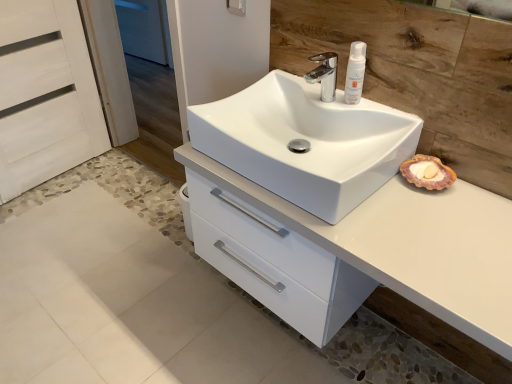
Question: Is the position of white glossy sink at center more distant than that of white matte lotion at upper right?

Choices:
 (A) no
 (B) yes

Answer: (A)

Question: From the image's perspective, would you say white glossy sink at center is shown under white matte lotion at upper right?

Choices:
 (A) no
 (B) yes

Answer: (B)

Question: Is white glossy sink at center positioned before white matte lotion at upper right?

Choices:
 (A) yes
 (B) no

Answer: (A)

Question: Does white glossy sink at center appear on the right side of white matte lotion at upper right?

Choices:
 (A) yes
 (B) no

Answer: (B)

Question: Can you confirm if white glossy sink at center is shorter than white matte lotion at upper right?

Choices:
 (A) no
 (B) yes

Answer: (B)

Question: From the image's perspective, is white glossy sink at center above white matte lotion at upper right?

Choices:
 (A) yes
 (B) no

Answer: (B)

Question: Does chrome metallic faucet at upper center appear on the right side of white matte lotion at upper right?

Choices:
 (A) yes
 (B) no

Answer: (B)

Question: Can we say chrome metallic faucet at upper center lies outside white matte lotion at upper right?

Choices:
 (A) no
 (B) yes

Answer: (B)

Question: Would you consider chrome metallic faucet at upper center to be distant from white matte lotion at upper right?

Choices:
 (A) yes
 (B) no

Answer: (B)

Question: Is white matte lotion at upper right surrounded by chrome metallic faucet at upper center?

Choices:
 (A) yes
 (B) no

Answer: (B)

Question: Is chrome metallic faucet at upper center touching white matte lotion at upper right?

Choices:
 (A) no
 (B) yes

Answer: (A)

Question: Is chrome metallic faucet at upper center shorter than white matte lotion at upper right?

Choices:
 (A) no
 (B) yes

Answer: (B)

Question: Is white wood screen door at left, which appears as the 1th screen door when viewed from the right, not within chrome metallic faucet at upper center?

Choices:
 (A) no
 (B) yes

Answer: (B)